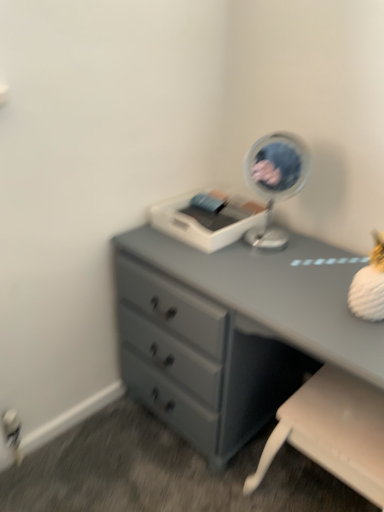
Image resolution: width=384 pixels, height=512 pixels. In order to click on metallic silver mirror at upper right in this screenshot , I will do `click(275, 181)`.

Where is `matte gray dresser at center`? This screenshot has width=384, height=512. matte gray dresser at center is located at coordinates tap(248, 322).

Is metallic silver mirror at upper right located within white plastic swivel chair at lower right?

That's incorrect, metallic silver mirror at upper right is not inside white plastic swivel chair at lower right.

From the image's perspective, is white plastic swivel chair at lower right located beneath metallic silver mirror at upper right?

Yes, from the image's perspective, white plastic swivel chair at lower right is below metallic silver mirror at upper right.

From a real-world perspective, which is physically below, white plastic swivel chair at lower right or metallic silver mirror at upper right?

In real-world perspective, white plastic swivel chair at lower right is lower.

Which object is more forward, matte gray dresser at center or metallic silver mirror at upper right?

matte gray dresser at center is closer to the camera.

Does matte gray dresser at center have a greater height compared to metallic silver mirror at upper right?

Yes, matte gray dresser at center is taller than metallic silver mirror at upper right.

How many degrees apart are the facing directions of matte gray dresser at center and metallic silver mirror at upper right?

They differ by 32.6 degrees in their facing directions.

From a real-world perspective, relative to metallic silver mirror at upper right, is matte gray dresser at center vertically above or below?

Clearly, from a real-world perspective, matte gray dresser at center is below metallic silver mirror at upper right.

From a real-world perspective, who is located lower, metallic silver mirror at upper right or matte gray dresser at center?

matte gray dresser at center is physically lower.

Is metallic silver mirror at upper right turned away from matte gray dresser at center?

No, metallic silver mirror at upper right is not facing away from matte gray dresser at center.

Is metallic silver mirror at upper right thinner than matte gray dresser at center?

Correct, the width of metallic silver mirror at upper right is less than that of matte gray dresser at center.

From the image's perspective, is metallic silver mirror at upper right located above or below matte gray dresser at center?

metallic silver mirror at upper right is above matte gray dresser at center.

Can you tell me how much white plastic swivel chair at lower right and matte gray dresser at center differ in facing direction?

The angular difference between white plastic swivel chair at lower right and matte gray dresser at center is 0.000107 degrees.

At what (x,y) coordinates should I click in order to perform the action: click on swivel chair lying below the matte gray dresser at center (from the image's perspective). Please return your answer as a coordinate pair (x, y). The height and width of the screenshot is (512, 384). Looking at the image, I should click on (333, 431).

Which of these two, white plastic swivel chair at lower right or matte gray dresser at center, is bigger?

matte gray dresser at center is bigger.

Is white plastic swivel chair at lower right not inside matte gray dresser at center?

That's incorrect, white plastic swivel chair at lower right is not completely outside matte gray dresser at center.

Is metallic silver mirror at upper right facing away from white plastic swivel chair at lower right?

No, metallic silver mirror at upper right's orientation is not away from white plastic swivel chair at lower right.

This screenshot has height=512, width=384. In the image, there is a metallic silver mirror at upper right. What are the coordinates of `swivel chair below it (from the image's perspective)` in the screenshot? It's located at (333, 431).

Can you see metallic silver mirror at upper right touching white plastic swivel chair at lower right?

No, metallic silver mirror at upper right is not next to white plastic swivel chair at lower right.

Looking at their sizes, would you say metallic silver mirror at upper right is wider or thinner than white plastic swivel chair at lower right?

In the image, metallic silver mirror at upper right appears to be more narrow than white plastic swivel chair at lower right.

Would you consider matte gray dresser at center to be distant from white plastic swivel chair at lower right?

matte gray dresser at center is near white plastic swivel chair at lower right, not far away.

Is matte gray dresser at center facing towards white plastic swivel chair at lower right?

Yes, matte gray dresser at center is facing white plastic swivel chair at lower right.

What are the coordinates of `swivel chair that appears behind the matte gray dresser at center` in the screenshot? It's located at (333, 431).

Where is `printer that is behind the metallic silver mirror at upper right`? printer that is behind the metallic silver mirror at upper right is located at coordinates (207, 219).

Visually, is metallic silver mirror at upper right positioned to the left or to the right of white plastic printer at center?

metallic silver mirror at upper right is positioned on white plastic printer at center's right side.

In the scene shown: From the image's perspective, which object appears higher, metallic silver mirror at upper right or white plastic printer at center?

From the image's view, metallic silver mirror at upper right is above.

Does metallic silver mirror at upper right have a smaller size compared to white plastic printer at center?

Actually, metallic silver mirror at upper right might be larger than white plastic printer at center.

Locate an element on the screen. swivel chair in front of the metallic silver mirror at upper right is located at coordinates point(333,431).

You are a GUI agent. You are given a task and a screenshot of the screen. Output one action in this format:
    pyautogui.click(x=<x>, y=<y>)
    Task: Click on the chest of drawers below the metallic silver mirror at upper right (from the image's perspective)
    This screenshot has height=512, width=384.
    Given the screenshot: What is the action you would take?
    pyautogui.click(x=248, y=322)

Based on their spatial positions, is metallic silver mirror at upper right or white plastic printer at center further from white plastic swivel chair at lower right?

Based on the image, white plastic printer at center appears to be further to white plastic swivel chair at lower right.

Considering their positions, is matte gray dresser at center positioned further to white plastic swivel chair at lower right than white plastic printer at center?

white plastic printer at center is further to white plastic swivel chair at lower right.

Which object lies further to the anchor point metallic silver mirror at upper right, white plastic printer at center or white plastic swivel chair at lower right?

white plastic swivel chair at lower right is positioned further to the anchor metallic silver mirror at upper right.

In the scene shown: Based on their spatial positions, is metallic silver mirror at upper right or white plastic swivel chair at lower right closer to white plastic printer at center?

Among the two, metallic silver mirror at upper right is located nearer to white plastic printer at center.

Looking at the image, which one is located further to white plastic swivel chair at lower right, matte gray dresser at center or metallic silver mirror at upper right?

metallic silver mirror at upper right.

Estimate the real-world distances between objects in this image. Which object is closer to matte gray dresser at center, metallic silver mirror at upper right or white plastic printer at center?

Based on the image, white plastic printer at center appears to be nearer to matte gray dresser at center.

Looking at the image, which one is located further to metallic silver mirror at upper right, white plastic swivel chair at lower right or white plastic printer at center?

white plastic swivel chair at lower right is positioned further to the anchor metallic silver mirror at upper right.

Estimate the real-world distances between objects in this image. Which object is further from white plastic swivel chair at lower right, white plastic printer at center or matte gray dresser at center?

white plastic printer at center lies further to white plastic swivel chair at lower right than the other object.

Find the location of a particular element. The width and height of the screenshot is (384, 512). printer between metallic silver mirror at upper right and matte gray dresser at center in the up-down direction is located at coordinates (207, 219).

I want to click on chest of drawers between white plastic printer at center and white plastic swivel chair at lower right from top to bottom, so 248,322.

Where is `chest of drawers between metallic silver mirror at upper right and white plastic swivel chair at lower right in the vertical direction`? This screenshot has height=512, width=384. chest of drawers between metallic silver mirror at upper right and white plastic swivel chair at lower right in the vertical direction is located at coordinates (248, 322).

Locate an element on the screen. This screenshot has width=384, height=512. printer between metallic silver mirror at upper right and white plastic swivel chair at lower right in the up-down direction is located at coordinates (207, 219).